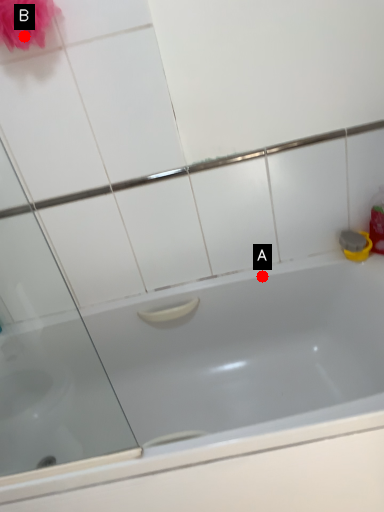
Question: Two points are circled on the image, labeled by A and B beside each circle. Which point is farther from the camera taking this photo?

Choices:
 (A) A is further
 (B) B is further

Answer: (A)